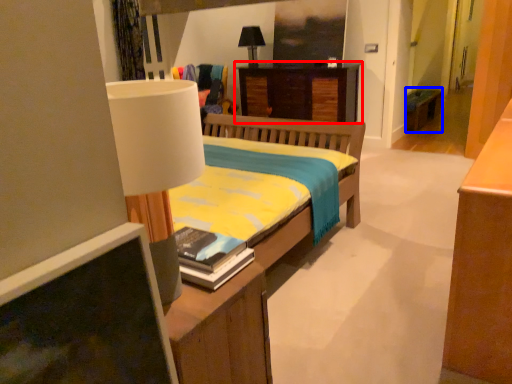
Question: Among these objects, which one is farthest to the camera, desk (highlighted by a red box) or table (highlighted by a blue box)?

Choices:
 (A) desk
 (B) table

Answer: (B)